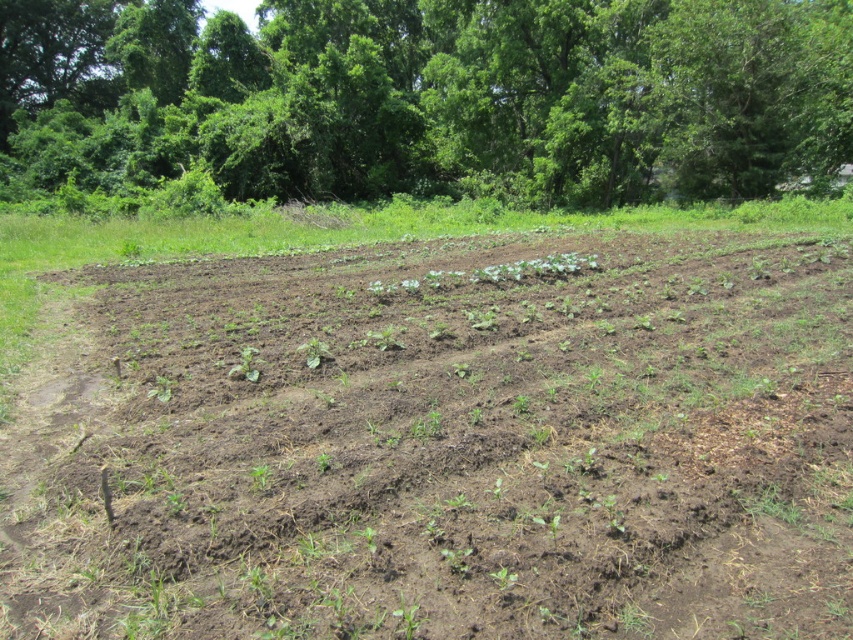
Question: Is brown soil at center to the right of green leafy trees at upper center from the viewer's perspective?

Choices:
 (A) yes
 (B) no

Answer: (A)

Question: Is brown soil at center above green leafy trees at upper center?

Choices:
 (A) no
 (B) yes

Answer: (A)

Question: Considering the relative positions of brown soil at center and green leafy trees at upper center in the image provided, where is brown soil at center located with respect to green leafy trees at upper center?

Choices:
 (A) below
 (B) above

Answer: (A)

Question: Which point is closer to the camera?

Choices:
 (A) (846, 472)
 (B) (96, 76)

Answer: (A)

Question: Which of the following is the closest to the observer?

Choices:
 (A) (756, 307)
 (B) (418, 161)

Answer: (A)

Question: Among these objects, which one is nearest to the camera?

Choices:
 (A) green leafy trees at upper center
 (B) brown soil at center

Answer: (B)